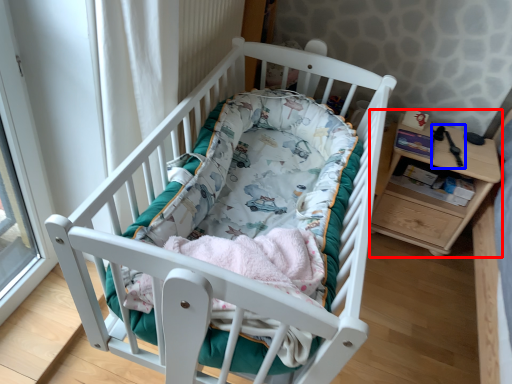
Question: Among these objects, which one is farthest to the camera, changing table (highlighted by a red box) or equipment (highlighted by a blue box)?

Choices:
 (A) changing table
 (B) equipment

Answer: (B)